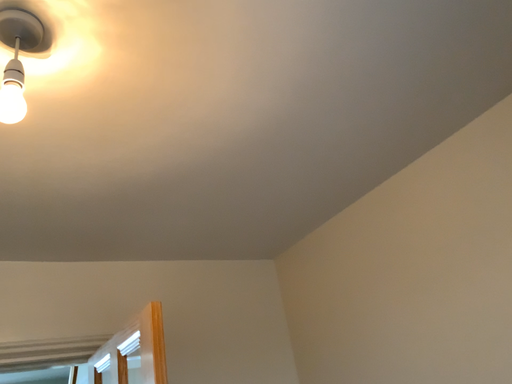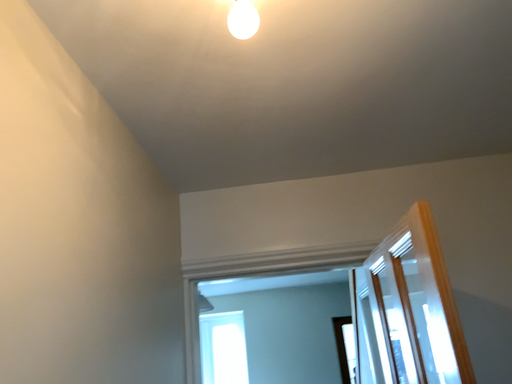
Question: Which way did the camera rotate in the video?

Choices:
 (A) rotated right
 (B) rotated left

Answer: (B)